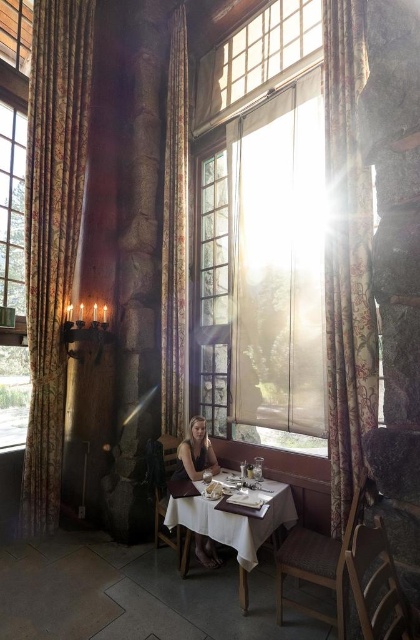
Question: Does translucent glass window at center have a lesser width compared to white cloth table at center?

Choices:
 (A) no
 (B) yes

Answer: (A)

Question: Estimate the real-world distances between objects in this image. Which object is farther from the matte brown dress at center?

Choices:
 (A) white paper napkin at center
 (B) white cloth table at center
 (C) floral fabric curtain at center

Answer: (C)

Question: Does gold floral fabric curtain at left have a larger size compared to white cloth table at center?

Choices:
 (A) no
 (B) yes

Answer: (B)

Question: Which object is the farthest from the gold floral fabric curtain at left?

Choices:
 (A) white cloth table at center
 (B) translucent glass window at center
 (C) matte brown dress at center
 (D) white paper napkin at center

Answer: (D)

Question: Is translucent glass window at center bigger than matte brown dress at center?

Choices:
 (A) no
 (B) yes

Answer: (B)

Question: Which is farther from the white cloth table at center?

Choices:
 (A) translucent glass window at center
 (B) floral fabric curtain at center

Answer: (B)